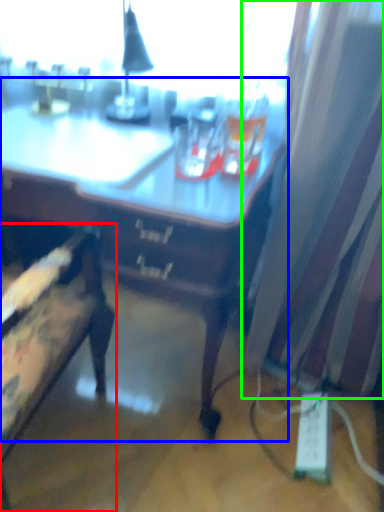
Question: Based on their relative distances, which object is nearer to chair (highlighted by a red box)? Choose from desk (highlighted by a blue box) and curtain (highlighted by a green box).

Choices:
 (A) desk
 (B) curtain

Answer: (A)